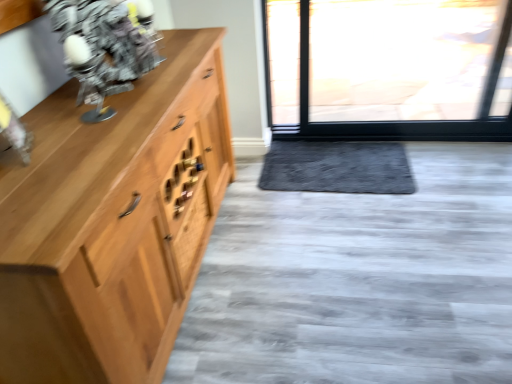
Question: Should I look upward or downward to see metallic silver robot at upper left?

Choices:
 (A) up
 (B) down

Answer: (A)

Question: Would you say metallic silver robot at upper left is a long distance from gray plush doormat at center?

Choices:
 (A) yes
 (B) no

Answer: (A)

Question: From a real-world perspective, does metallic silver robot at upper left stand above gray plush doormat at center?

Choices:
 (A) yes
 (B) no

Answer: (A)

Question: Is metallic silver robot at upper left facing towards gray plush doormat at center?

Choices:
 (A) yes
 (B) no

Answer: (B)

Question: Can you confirm if metallic silver robot at upper left is taller than gray plush doormat at center?

Choices:
 (A) yes
 (B) no

Answer: (A)

Question: Can gray plush doormat at center be found inside metallic silver robot at upper left?

Choices:
 (A) yes
 (B) no

Answer: (B)

Question: Is metallic silver robot at upper left at the left side of gray plush doormat at center?

Choices:
 (A) no
 (B) yes

Answer: (B)

Question: From the image's perspective, would you say gray plush doormat at center is shown under metallic silver robot at upper left?

Choices:
 (A) yes
 (B) no

Answer: (A)

Question: Is gray plush doormat at center turned away from metallic silver robot at upper left?

Choices:
 (A) no
 (B) yes

Answer: (A)

Question: Does gray plush doormat at center have a lesser width compared to metallic silver robot at upper left?

Choices:
 (A) yes
 (B) no

Answer: (B)

Question: Considering the relative sizes of gray plush doormat at center and metallic silver robot at upper left in the image provided, is gray plush doormat at center wider than metallic silver robot at upper left?

Choices:
 (A) yes
 (B) no

Answer: (A)

Question: Considering the relative positions of gray plush doormat at center and metallic silver robot at upper left in the image provided, is gray plush doormat at center to the right of metallic silver robot at upper left from the viewer's perspective?

Choices:
 (A) yes
 (B) no

Answer: (A)

Question: Is gray plush doormat at center shorter than metallic silver robot at upper left?

Choices:
 (A) yes
 (B) no

Answer: (A)

Question: From the image's perspective, is metallic silver robot at upper left on wooden drawer at center?

Choices:
 (A) no
 (B) yes

Answer: (B)